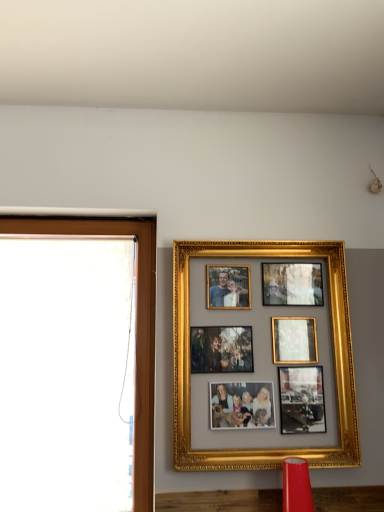
Measure the distance between gold/gilded photo frame at upper center and camera.

6.31 feet.

Where is `matte red lampshade at lower center`? The height and width of the screenshot is (512, 384). matte red lampshade at lower center is located at coordinates (296, 486).

I want to click on gold/gilded photo frame at upper center, so click(332, 353).

Is there a large distance between gold/gilded photo frame at upper center and brown wooden window frame at left?

No, there isn't a large distance between gold/gilded photo frame at upper center and brown wooden window frame at left.

Is point (179, 398) behind point (105, 232)?

No, it is not.

In the scene shown: Relative to brown wooden window frame at left, is gold/gilded photo frame at upper center in front or behind?

Visually, gold/gilded photo frame at upper center is located in front of brown wooden window frame at left.

Does gold/gilded photo frame at upper center have a lesser width compared to brown wooden window frame at left?

In fact, gold/gilded photo frame at upper center might be wider than brown wooden window frame at left.

Considering the sizes of matte red lampshade at lower center and gold/gilded photo frame at upper center in the image, is matte red lampshade at lower center wider or thinner than gold/gilded photo frame at upper center?

In the image, matte red lampshade at lower center appears to be wider than gold/gilded photo frame at upper center.

Is matte red lampshade at lower center oriented away from gold/gilded photo frame at upper center?

No.

Where is `picture frame behind the matte red lampshade at lower center`? picture frame behind the matte red lampshade at lower center is located at coordinates (332, 353).

Can you confirm if matte red lampshade at lower center is bigger than gold/gilded photo frame at upper center?

No.

Where is `lamp that is on the right side of gold/gilded photo frame at upper center`? The image size is (384, 512). lamp that is on the right side of gold/gilded photo frame at upper center is located at coordinates (296, 486).

Does point (344, 274) lie behind point (288, 465)?

That is True.

From the image's perspective, is gold/gilded photo frame at upper center positioned above or below matte red lampshade at lower center?

gold/gilded photo frame at upper center is situated higher than matte red lampshade at lower center in the image.

Which of these two, gold/gilded photo frame at upper center or matte red lampshade at lower center, is wider?

Wider between the two is matte red lampshade at lower center.

Which is in front, point (295, 460) or point (25, 227)?

The point (295, 460) is in front.

Would you say matte red lampshade at lower center is inside or outside brown wooden window frame at left?

matte red lampshade at lower center is not inside brown wooden window frame at left, it's outside.

Does matte red lampshade at lower center have a greater width compared to brown wooden window frame at left?

Yes.

Is matte red lampshade at lower center taller than brown wooden window frame at left?

Incorrect, the height of matte red lampshade at lower center is not larger of that of brown wooden window frame at left.

Is brown wooden window frame at left far away from gold/gilded photo frame at upper center?

No, there isn't a large distance between brown wooden window frame at left and gold/gilded photo frame at upper center.

How far apart are brown wooden window frame at left and gold/gilded photo frame at upper center?

19.78 inches.

From a real-world perspective, who is located lower, brown wooden window frame at left or gold/gilded photo frame at upper center?

From a 3D spatial view, brown wooden window frame at left is below.

Which of these two, brown wooden window frame at left or gold/gilded photo frame at upper center, stands taller?

With more height is brown wooden window frame at left.

Which object is wider, brown wooden window frame at left or matte red lampshade at lower center?

matte red lampshade at lower center is wider.

Consider the image. Does brown wooden window frame at left appear on the right side of matte red lampshade at lower center?

In fact, brown wooden window frame at left is to the left of matte red lampshade at lower center.

From a real-world perspective, is brown wooden window frame at left positioned over matte red lampshade at lower center based on gravity?

Yes, from a real-world perspective, brown wooden window frame at left is on top of matte red lampshade at lower center.

Is brown wooden window frame at left bigger than matte red lampshade at lower center?

Yes, brown wooden window frame at left is bigger than matte red lampshade at lower center.

Find the location of `picture frame that appears above the brown wooden window frame at left (from the image's perspective)`. picture frame that appears above the brown wooden window frame at left (from the image's perspective) is located at coordinates (332, 353).

This screenshot has width=384, height=512. Identify the location of picture frame that is behind the matte red lampshade at lower center. (x=332, y=353).

When comparing their distances from gold/gilded photo frame at upper center, does brown wooden window frame at left or matte red lampshade at lower center seem closer?

matte red lampshade at lower center lies closer to gold/gilded photo frame at upper center than the other object.

Considering their positions, is brown wooden window frame at left positioned closer to matte red lampshade at lower center than gold/gilded photo frame at upper center?

gold/gilded photo frame at upper center is closer to matte red lampshade at lower center.

Consider the image. Based on their spatial positions, is matte red lampshade at lower center or gold/gilded photo frame at upper center further from brown wooden window frame at left?

matte red lampshade at lower center is further to brown wooden window frame at left.

When comparing their distances from gold/gilded photo frame at upper center, does matte red lampshade at lower center or brown wooden window frame at left seem further?

brown wooden window frame at left is positioned further to the anchor gold/gilded photo frame at upper center.

Considering their positions, is gold/gilded photo frame at upper center positioned further to matte red lampshade at lower center than brown wooden window frame at left?

Among the two, brown wooden window frame at left is located further to matte red lampshade at lower center.

Estimate the real-world distances between objects in this image. Which object is further from brown wooden window frame at left, gold/gilded photo frame at upper center or matte red lampshade at lower center?

The object further to brown wooden window frame at left is matte red lampshade at lower center.

Where is `picture frame situated between brown wooden window frame at left and matte red lampshade at lower center from left to right`? Image resolution: width=384 pixels, height=512 pixels. picture frame situated between brown wooden window frame at left and matte red lampshade at lower center from left to right is located at coordinates (332, 353).